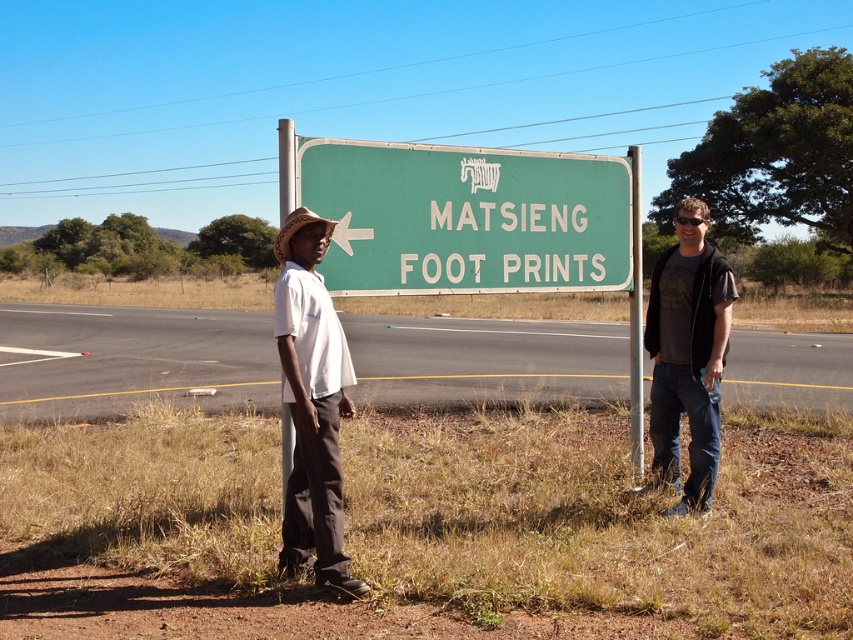
You are standing at the road and want to reach the green painted metal pole at center and the brushed metal pole at left. Which pole should you walk towards first to get to the closer one?

The green painted metal pole at center is closer to you, so you should walk towards the green painted metal pole at center first.

You are standing at the road sign and want to take a photo that includes both point [428,156] and point [636,202]. Which point should you focus on first to ensure both are in clear focus?

You should focus on point [428,156] first because it is closer to the camera than point [636,202], ensuring both are within the depth of field.